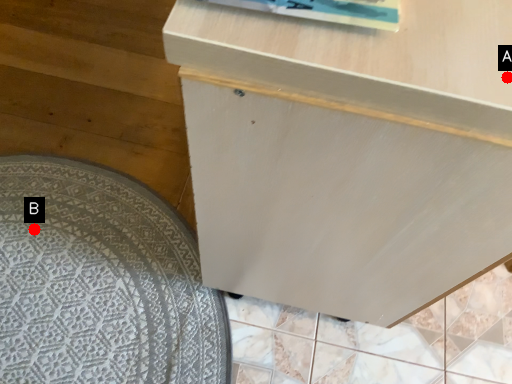
Question: Two points are circled on the image, labeled by A and B beside each circle. Which point appears farthest from the camera in this image?

Choices:
 (A) A is further
 (B) B is further

Answer: (B)